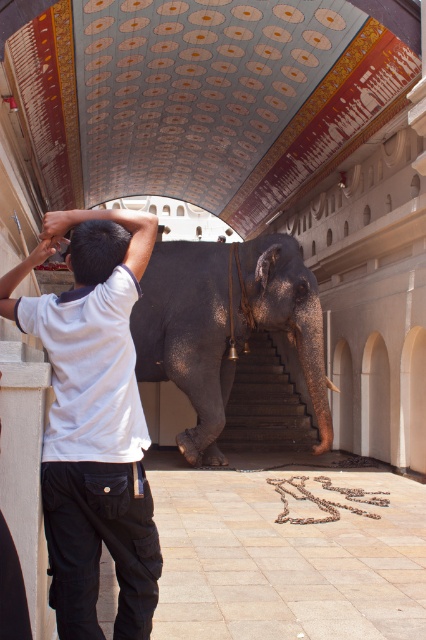
Is white cotton shirt at left to the right of gray textured elephant at center from the viewer's perspective?

In fact, white cotton shirt at left is to the left of gray textured elephant at center.

Who is shorter, white cotton shirt at left or gray textured elephant at center?

With less height is gray textured elephant at center.

Which is in front, point (141, 218) or point (316, 444)?

Point (141, 218) is in front.

Find the location of `white cotton shirt at left`. white cotton shirt at left is located at coordinates (94, 419).

Between point (63, 376) and point (253, 337), which one is positioned behind?

The point (253, 337) is behind.

Is white cotton shirt at left to the left of dark gray stone stairs at center from the viewer's perspective?

Correct, you'll find white cotton shirt at left to the left of dark gray stone stairs at center.

Is point (45, 342) in front of point (247, 438)?

Yes, it is in front of point (247, 438).

The width and height of the screenshot is (426, 640). I want to click on white cotton shirt at left, so click(94, 419).

Is gray textured elephant at center taller than dark gray stone stairs at center?

Indeed, gray textured elephant at center has a greater height compared to dark gray stone stairs at center.

Is point (273, 328) farther from camera compared to point (238, 426)?

No, (273, 328) is in front of (238, 426).

The width and height of the screenshot is (426, 640). I want to click on gray textured elephant at center, so click(x=224, y=324).